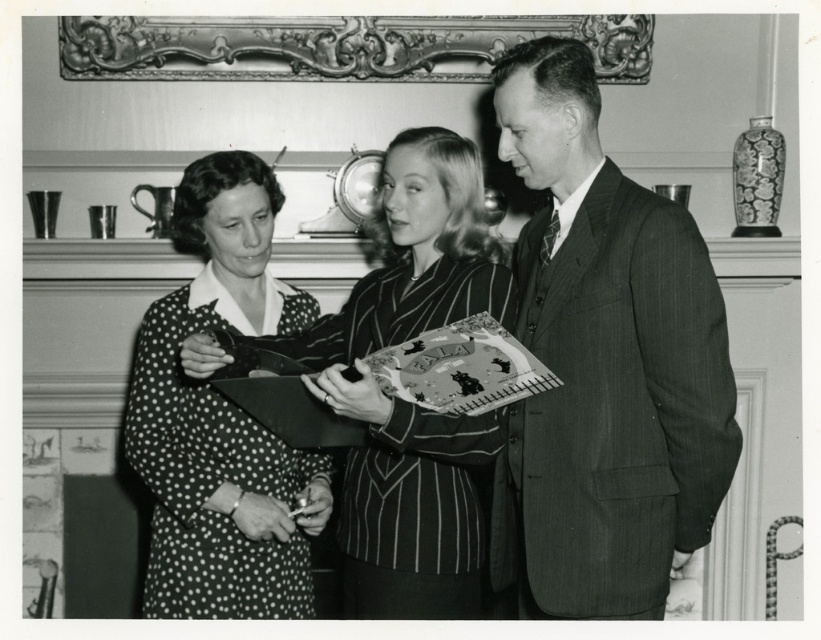
Question: Which point is closer to the camera taking this photo?

Choices:
 (A) (672, 355)
 (B) (461, 154)

Answer: (A)

Question: Which of these objects is positioned farthest from the gold ornate picture frame at upper center?

Choices:
 (A) polka dot fabric dress at left
 (B) textured pinstripe suit at right
 (C) polka dot fabric dress at center

Answer: (B)

Question: Can you confirm if textured pinstripe suit at right is positioned to the left of polka dot fabric dress at center?

Choices:
 (A) yes
 (B) no

Answer: (B)

Question: Is polka dot fabric dress at center above gold ornate picture frame at upper center?

Choices:
 (A) no
 (B) yes

Answer: (A)

Question: Is polka dot fabric dress at center further to camera compared to polka dot fabric dress at left?

Choices:
 (A) no
 (B) yes

Answer: (A)

Question: Among these objects, which one is nearest to the camera?

Choices:
 (A) gold ornate picture frame at upper center
 (B) polka dot fabric dress at center
 (C) textured pinstripe suit at right
 (D) polka dot fabric dress at left

Answer: (C)